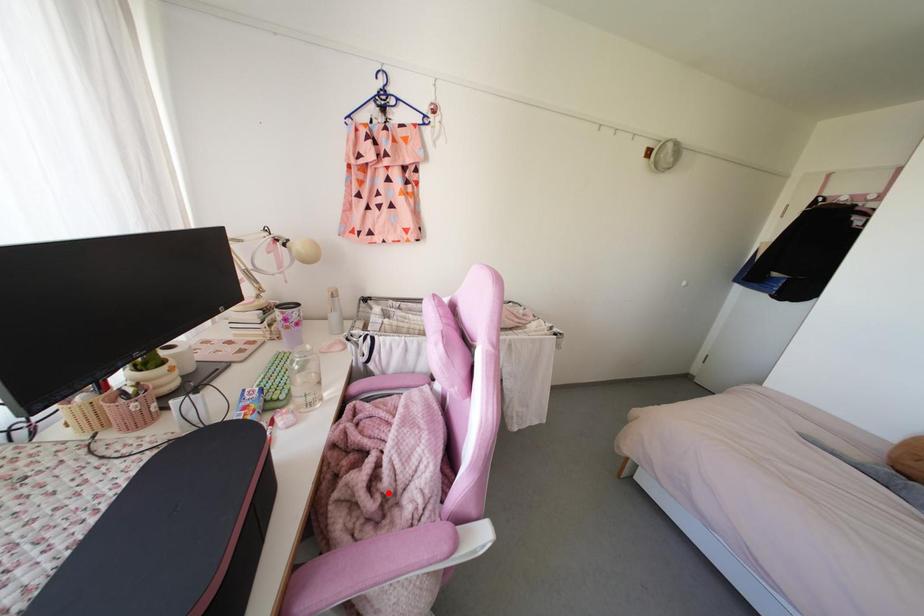
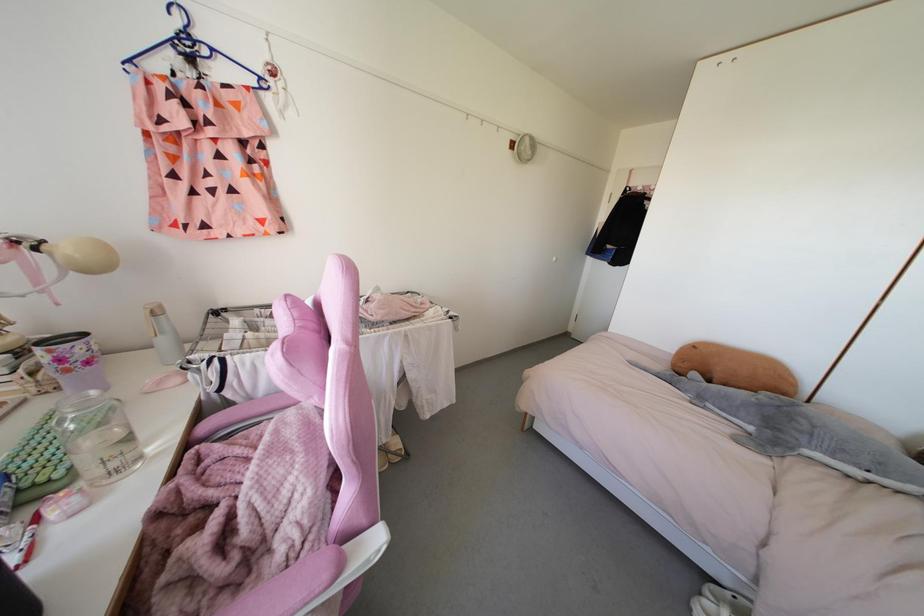
Where in the second image is the point corresponding to the highlighted location from the first image?

(252, 543)